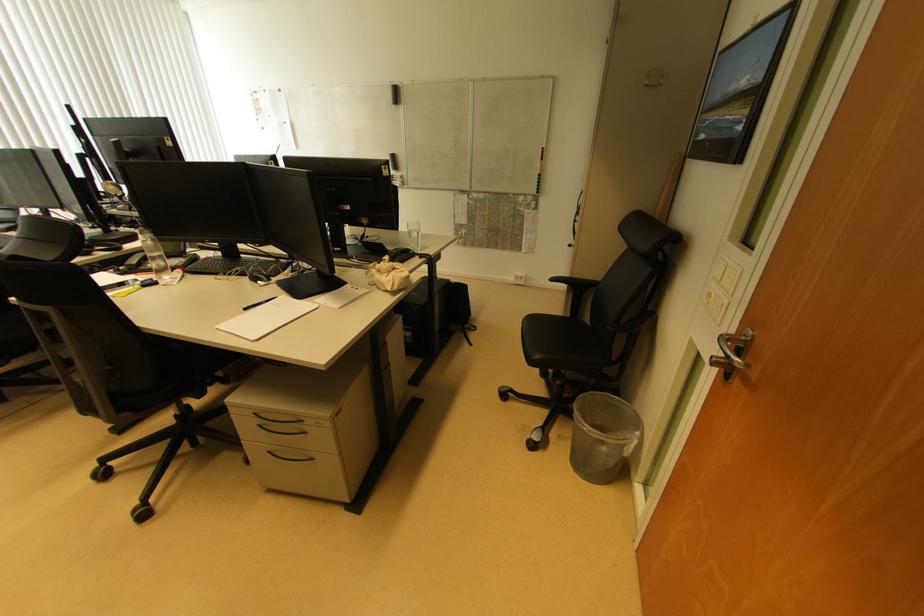
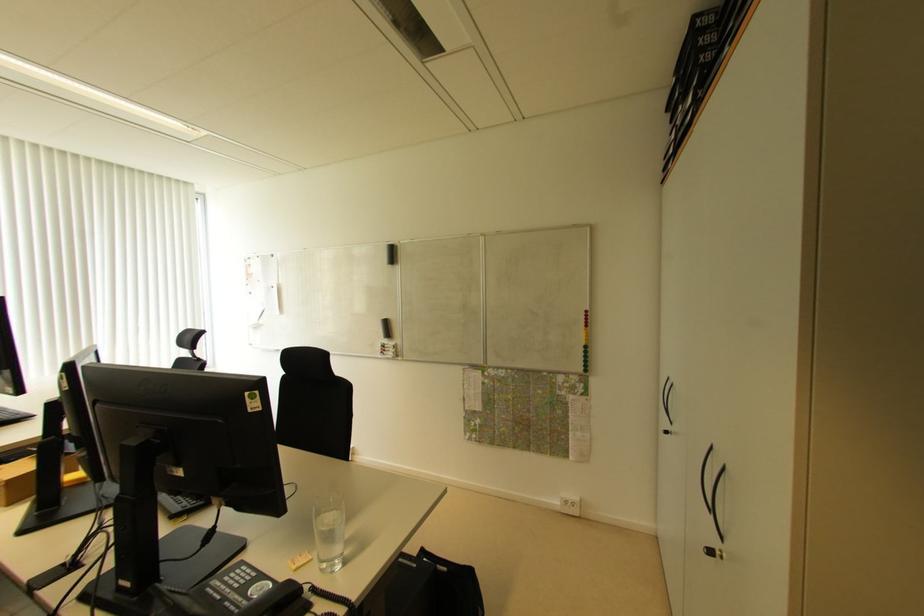
Question: In a continuous first-person perspective shot, in which direction is the camera moving?

Choices:
 (A) Left
 (B) Right
 (C) Forward
 (D) Backward

Answer: (C)